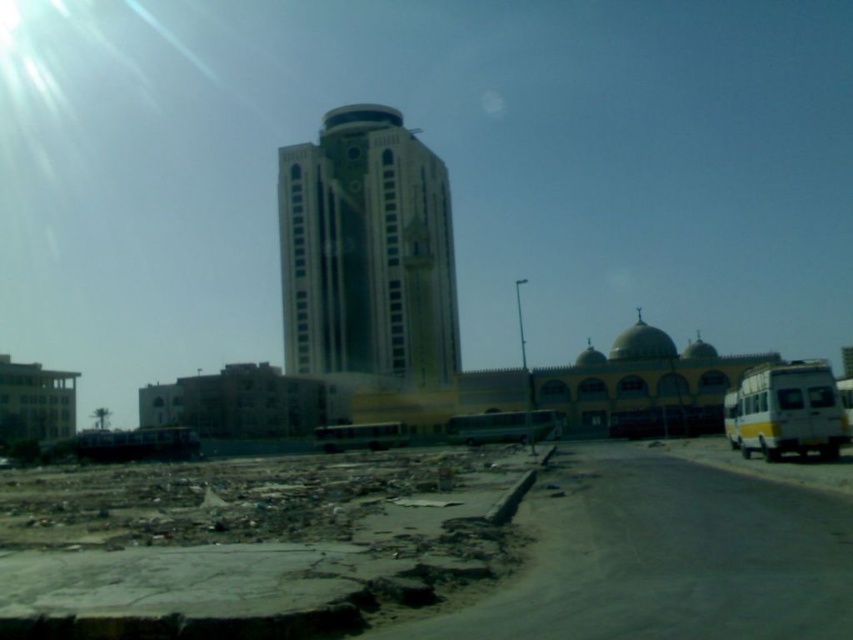
Question: Which of the following is the closest to the observer?

Choices:
 (A) (492, 436)
 (B) (437, 168)
 (C) (376, 432)
 (D) (776, 376)

Answer: (D)

Question: Does white glossy building at center appear on the right side of green metallic bus at center?

Choices:
 (A) yes
 (B) no

Answer: (B)

Question: Can you confirm if green metallic bus at center is positioned above yellow metallic bus at center?

Choices:
 (A) yes
 (B) no

Answer: (A)

Question: Which object is the farthest from the white glossy building at center?

Choices:
 (A) yellow metallic bus at center
 (B) green metallic bus at center
 (C) white/yellow painted bus at right

Answer: (C)

Question: Where is white glossy building at center located in relation to yellow metallic bus at center in the image?

Choices:
 (A) above
 (B) below

Answer: (A)

Question: Which of the following is the closest to the observer?

Choices:
 (A) green metallic bus at center
 (B) white/yellow painted bus at right
 (C) yellow metallic bus at center
 (D) white glossy building at center

Answer: (B)